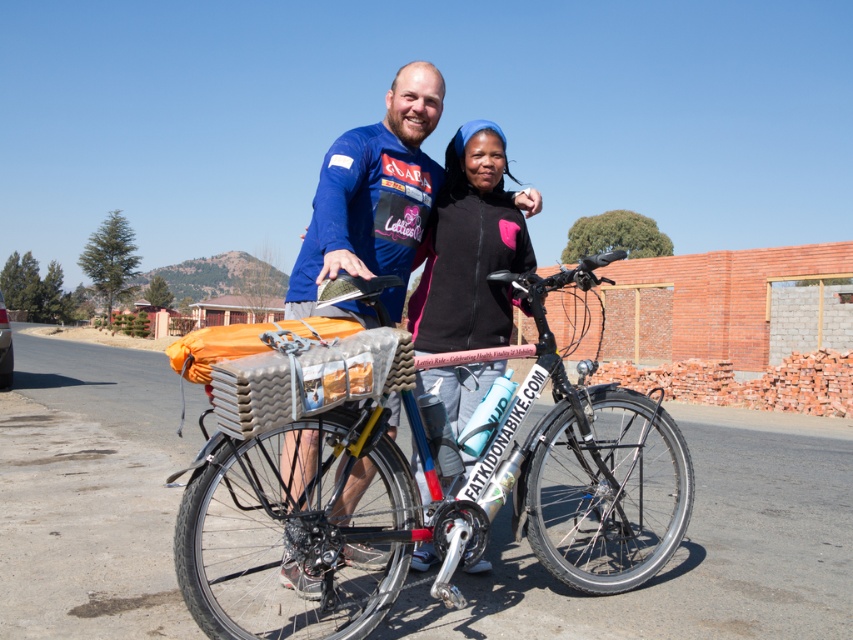
You are a photographer trying to capture a group photo of the two people wearing the blue fabric shirt at center and the black fleece jacket at center. The camera you are using has a minimum focusing distance of 36 inches. Can you take the photo without moving either of them?

The blue fabric shirt at center and black fleece jacket at center are 38.98 inches apart from each other, which is beyond the camera minimum focusing distance of 36 inches. Therefore, you can take the photo without moving them.

You are a photographer taking a photo of the silver metallic bicycle at center and the blue fabric shirt at center. Which object is shorter in the image?

The silver metallic bicycle at center is shorter than the blue fabric shirt at center.

You are a photographer trying to capture a group photo of the two people wearing the blue fabric shirt at center and the black fleece jacket at center. If you want to ensure both subjects are fully visible in the frame, which clothing item should you position closer to the camera?

The blue fabric shirt at center might be wider than the black fleece jacket at center, so to ensure both are fully visible, position the blue fabric shirt at center closer to the camera to avoid it being cropped out.